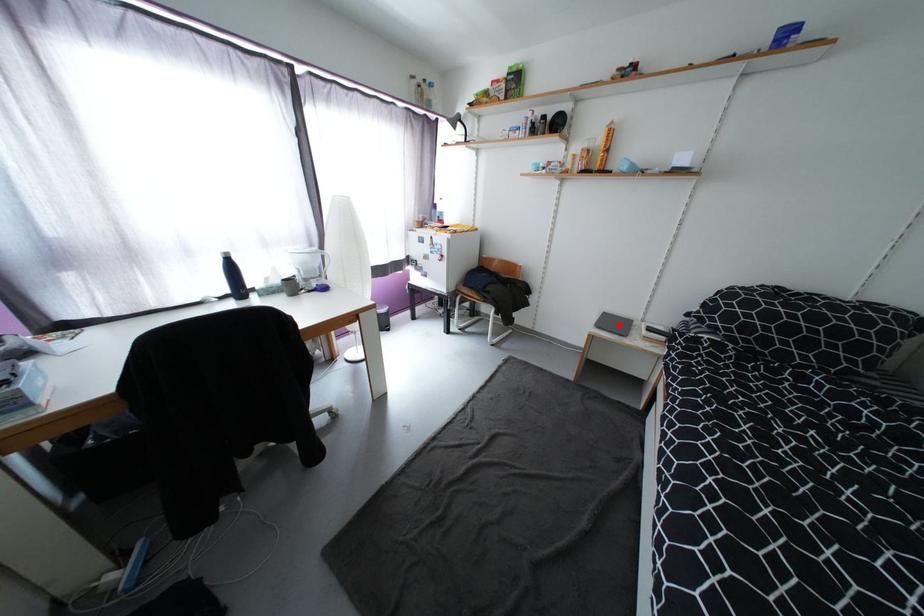
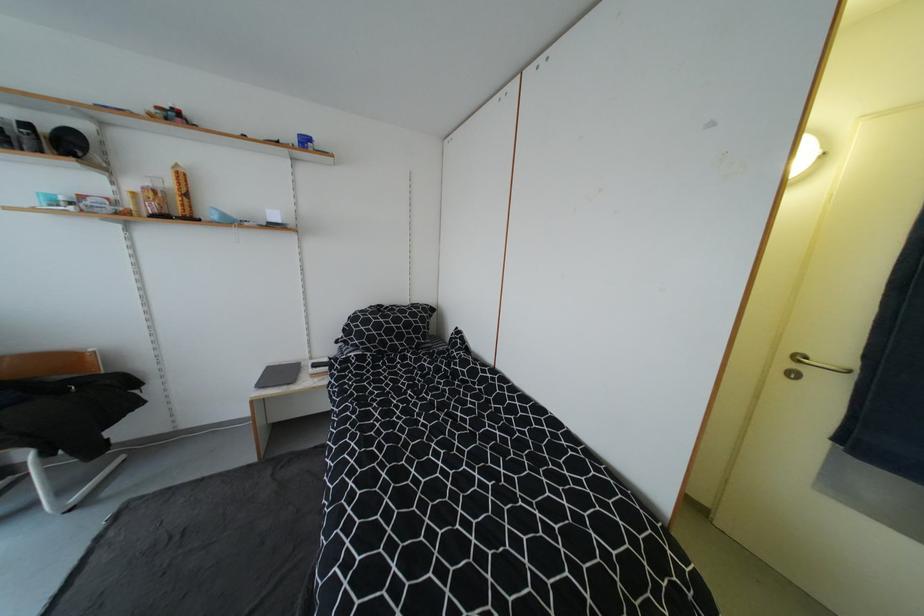
The point at the highlighted location is marked in the first image. Where is the corresponding point in the second image?

(286, 376)